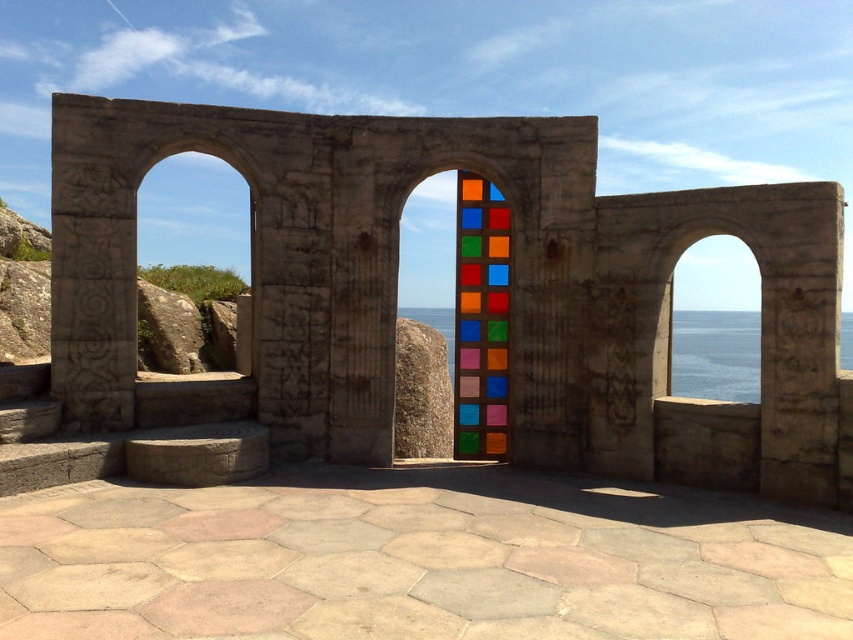
Who is positioned more to the right, multicolored glass door at center or transparent glass water at center?

From the viewer's perspective, transparent glass water at center appears more on the right side.

The width and height of the screenshot is (853, 640). Identify the location of multicolored glass door at center. click(x=511, y=291).

Locate an element on the screen. This screenshot has height=640, width=853. multicolored glass door at center is located at coordinates (511, 291).

Consider the image. Can you confirm if multicolored glass door at center is positioned below stained glass window at center?

No, multicolored glass door at center is not below stained glass window at center.

Does point (517, 412) lie in front of point (468, 280)?

Yes, point (517, 412) is closer to viewer.

Does point (720, 436) lie behind point (468, 188)?

No.

At what (x,y) coordinates should I click in order to perform the action: click on multicolored glass door at center. Please return your answer as a coordinate pair (x, y). Looking at the image, I should click on (511, 291).

Between stained glass window at center and blue glass water at right, which one is positioned lower?

Positioned lower is blue glass water at right.

Does stained glass window at center appear under blue glass water at right?

No, stained glass window at center is not below blue glass water at right.

Locate an element on the screen. The image size is (853, 640). stained glass window at center is located at coordinates (480, 320).